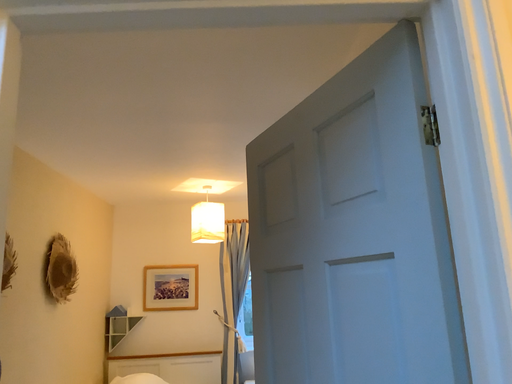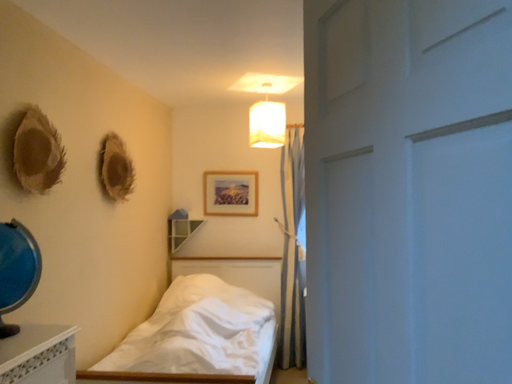
Question: How did the camera likely rotate when shooting the video?

Choices:
 (A) rotated left
 (B) rotated right

Answer: (A)